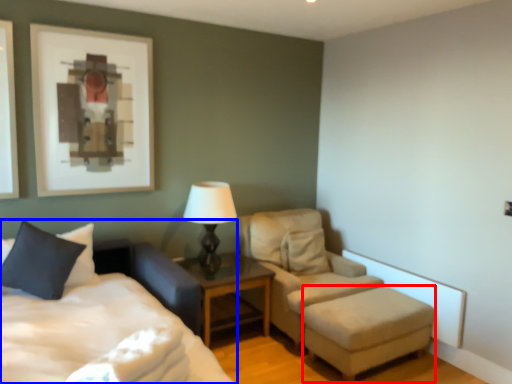
Question: Which object is closer to the camera taking this photo, stool (highlighted by a red box) or bed (highlighted by a blue box)?

Choices:
 (A) stool
 (B) bed

Answer: (B)